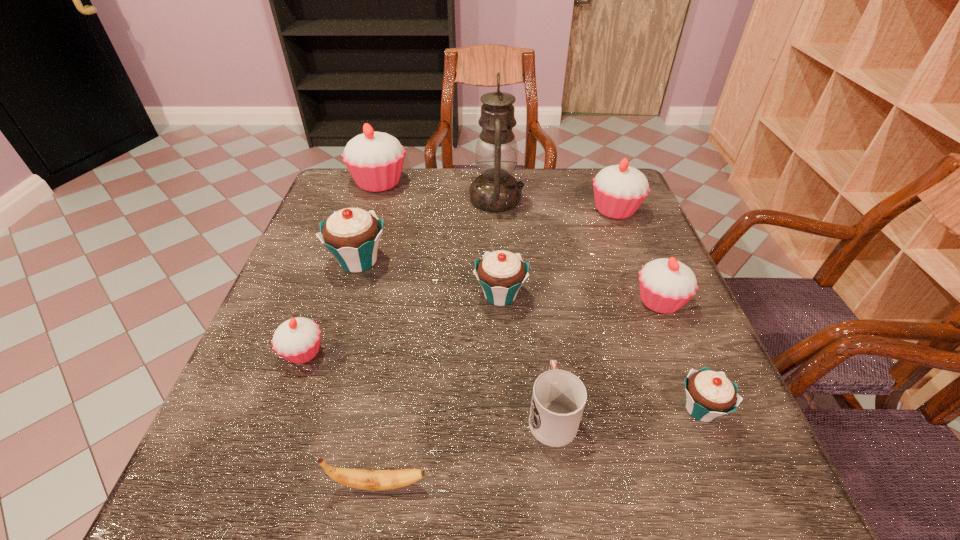
The height and width of the screenshot is (540, 960). What are the coordinates of `empty space that is in between the tallest object and the leftmost teal cupcake` in the screenshot? It's located at (427, 230).

You are a GUI agent. You are given a task and a screenshot of the screen. Output one action in this format:
    pyautogui.click(x=<x>, y=<y>)
    Task: Click on the free spot between the red cup and the fourth cupcake from right to left
    
    Given the screenshot: What is the action you would take?
    pyautogui.click(x=526, y=354)

Find the location of a particular element. This screenshot has height=540, width=960. vacant area that lies between the second nearest cupcake and the fourth cupcake from right to left is located at coordinates (401, 324).

Locate an element on the screen. Image resolution: width=960 pixels, height=540 pixels. empty space that is in between the second biggest pink cupcake and the second smallest pink cupcake is located at coordinates (637, 255).

Locate an element on the screen. The width and height of the screenshot is (960, 540). vacant area that lies between the banana and the biggest teal cupcake is located at coordinates (369, 373).

This screenshot has height=540, width=960. What are the coordinates of `free space between the banana and the second teal cupcake from left to right` in the screenshot? It's located at (440, 390).

Locate which object is the fourth closest to the sixth farthest cupcake. Please provide its 2D coordinates. Your answer should be formatted as a tuple, i.e. [(x, y)], where the tuple contains the x and y coordinates of a point satisfying the conditions above.

[(558, 399)]

Where is `the second closest object to the tallest object`? the second closest object to the tallest object is located at coordinates (375, 160).

What are the coordinates of `cupcake that is the seventh closest to the oil lamp` in the screenshot? It's located at (709, 394).

Identify which cupcake is the seventh nearest to the banana. Please provide its 2D coordinates. Your answer should be formatted as a tuple, i.e. [(x, y)], where the tuple contains the x and y coordinates of a point satisfying the conditions above.

[(375, 160)]